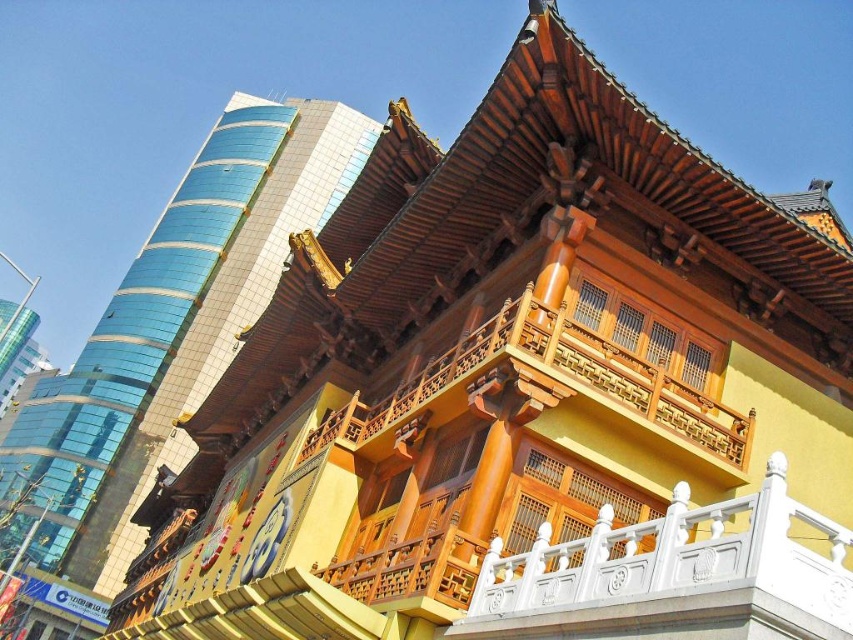
Question: Can you confirm if white stone balustrade at center is smaller than wooden balcony at center?

Choices:
 (A) yes
 (B) no

Answer: (A)

Question: Considering the real-world distances, which object is farthest from the wooden balcony at center?

Choices:
 (A) white stone balustrade at center
 (B) yellow wood temple at center

Answer: (B)

Question: Can you confirm if yellow wood temple at center is positioned to the right of wooden balcony at center?

Choices:
 (A) no
 (B) yes

Answer: (A)

Question: Which object appears farthest from the camera in this image?

Choices:
 (A) wooden balcony at center
 (B) yellow wood temple at center
 (C) white stone balustrade at center

Answer: (B)

Question: Does white stone balustrade at center come in front of wooden balcony at center?

Choices:
 (A) yes
 (B) no

Answer: (A)

Question: Which point appears closest to the camera in this image?

Choices:
 (A) (677, 433)
 (B) (74, 515)

Answer: (A)